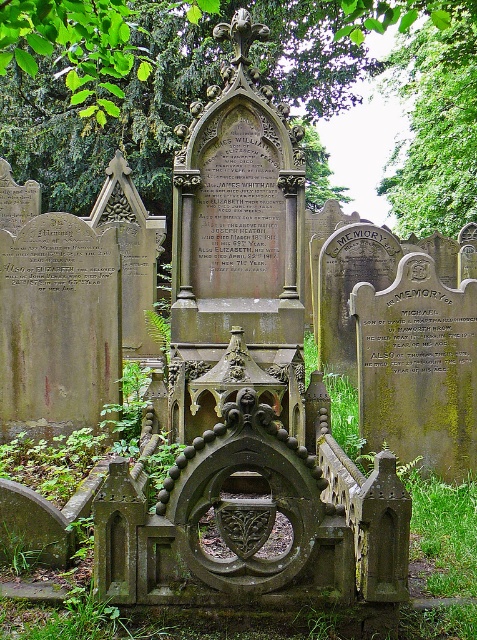
Question: Does green leafy tree at center appear over green leafy tree at upper center?

Choices:
 (A) no
 (B) yes

Answer: (A)

Question: Does green leafy tree at center appear under green leafy tree at upper center?

Choices:
 (A) yes
 (B) no

Answer: (A)

Question: Which object appears closest to the camera in this image?

Choices:
 (A) green leafy tree at center
 (B) green leafy tree at upper center

Answer: (A)

Question: Among these objects, which one is farthest from the camera?

Choices:
 (A) green leafy tree at upper center
 (B) green leafy tree at center

Answer: (A)

Question: Which object appears farthest from the camera in this image?

Choices:
 (A) green leafy tree at upper center
 (B) green leafy tree at center

Answer: (A)

Question: Does green leafy tree at center have a greater width compared to green leafy tree at upper center?

Choices:
 (A) yes
 (B) no

Answer: (A)